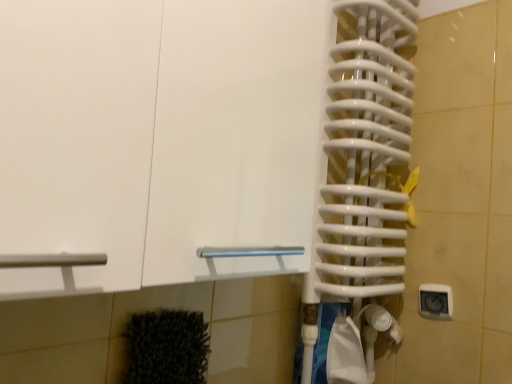
The image size is (512, 384). Describe the element at coordinates (436, 301) in the screenshot. I see `white plastic electric outlet at lower right` at that location.

You are a GUI agent. You are given a task and a screenshot of the screen. Output one action in this format:
    pyautogui.click(x=<x>, y=<y>)
    Task: Click on the white plastic electric outlet at lower right
    Image resolution: width=512 pixels, height=384 pixels.
    Given the screenshot: What is the action you would take?
    pyautogui.click(x=436, y=301)

This screenshot has width=512, height=384. What are the coordinates of `white plastic electric outlet at lower right` in the screenshot? It's located at (436, 301).